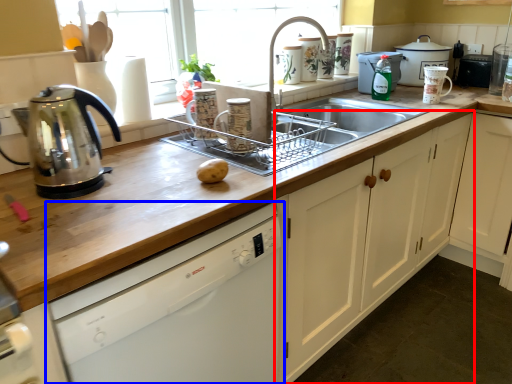
Question: Which object appears closest to the camera in this image, cabinetry (highlighted by a red box) or dishwasher (highlighted by a blue box)?

Choices:
 (A) cabinetry
 (B) dishwasher

Answer: (B)